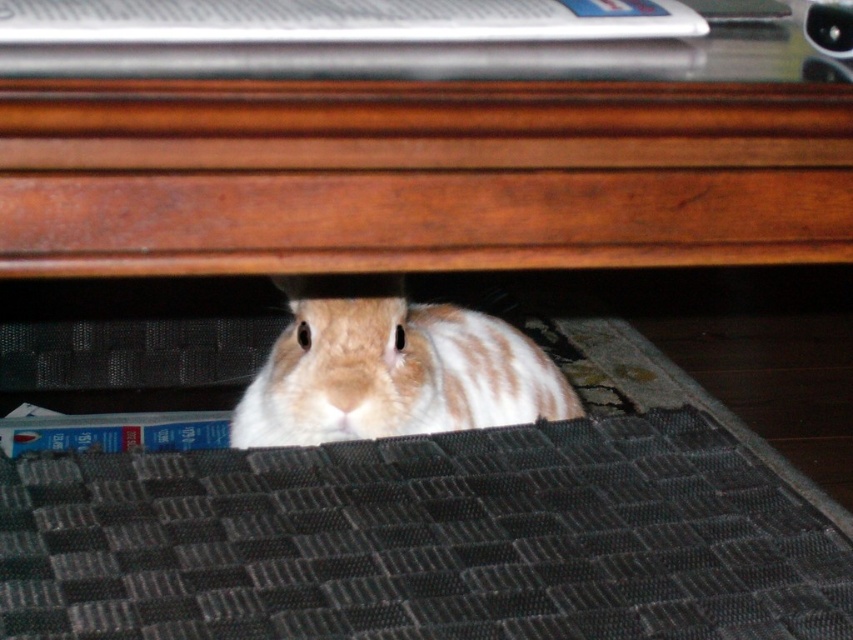
Which is above, brown wood table at center or brown and white fur rabbit under the desk?

brown wood table at center is higher up.

Looking at this image, does brown wood table at center appear over brown and white fur rabbit under the desk?

Correct, brown wood table at center is located above brown and white fur rabbit under the desk.

This screenshot has width=853, height=640. I want to click on brown wood table at center, so click(413, 138).

I want to click on brown wood table at center, so click(x=413, y=138).

Does brown wood table at center have a larger size compared to black textured mat at lower center?

Yes.

Who is more forward, [24,163] or [347,550]?

Point [24,163]

This screenshot has height=640, width=853. I want to click on brown wood table at center, so click(413, 138).

In the scene shown: Between black textured mat at lower center and brown and white fur rabbit under the desk, which one has more height?

brown and white fur rabbit under the desk is taller.

Can you confirm if black textured mat at lower center is shorter than brown and white fur rabbit under the desk?

Correct, black textured mat at lower center is not as tall as brown and white fur rabbit under the desk.

The image size is (853, 640). What do you see at coordinates (442, 529) in the screenshot? I see `black textured mat at lower center` at bounding box center [442, 529].

What are the coordinates of `black textured mat at lower center` in the screenshot? It's located at (442, 529).